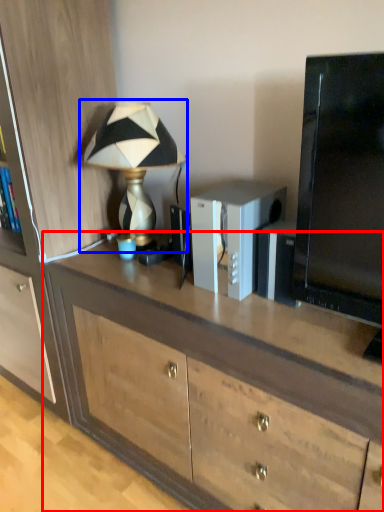
Question: Which point is further to the camera, desk (highlighted by a red box) or lamp (highlighted by a blue box)?

Choices:
 (A) desk
 (B) lamp

Answer: (B)